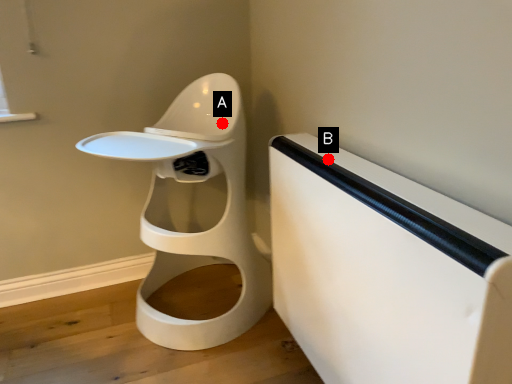
Question: Two points are circled on the image, labeled by A and B beside each circle. Which of the following is the farthest from the observer?

Choices:
 (A) A is further
 (B) B is further

Answer: (A)